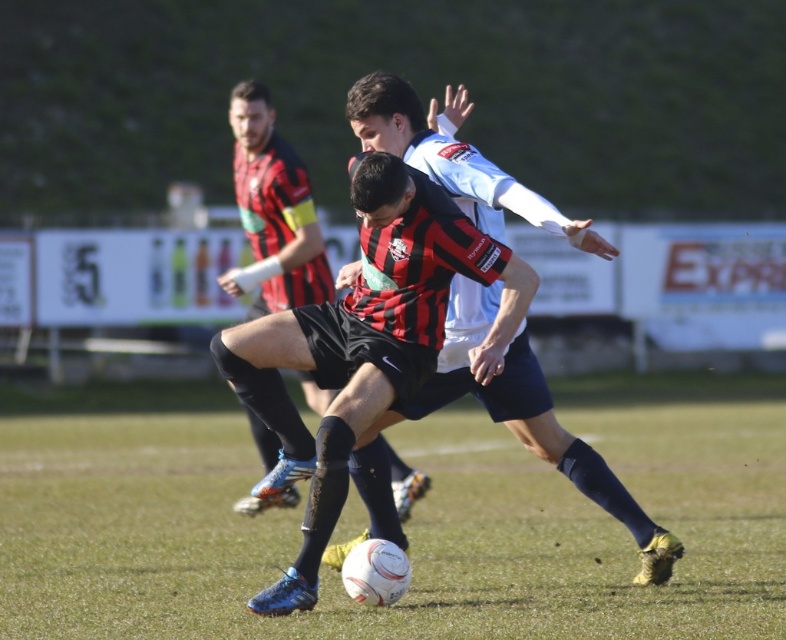
You are a soccer player trying to kick the ball. You notice the green grass at center and the matte black shorts at center. Which object is bigger in size?

The green grass at center has a larger size compared to the matte black shorts at center.

You are a soccer coach analyzing the players in the image. You notice the black and red striped jersey at center and the matte black shorts at center. Which of these two items is taller?

The black and red striped jersey at center is taller than the matte black shorts at center.

You are a soccer coach analyzing the field. You notice the green grass at center and the black and red striped jersey at center. Which object occupies more horizontal space in the image?

The green grass at center might be wider than black and red striped jersey at center.